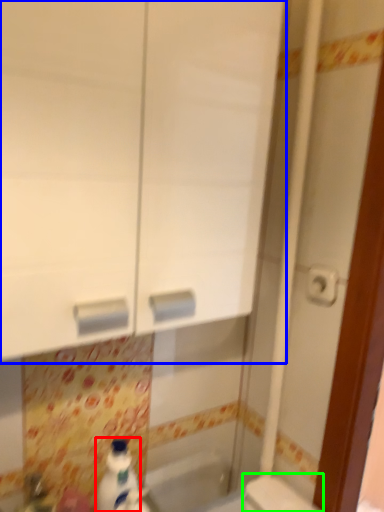
Question: Considering the real-world distances, which object is closest to cleaning product (highlighted by a red box)? medicine cabinet (highlighted by a blue box) or toilet (highlighted by a green box).

Choices:
 (A) medicine cabinet
 (B) toilet

Answer: (B)